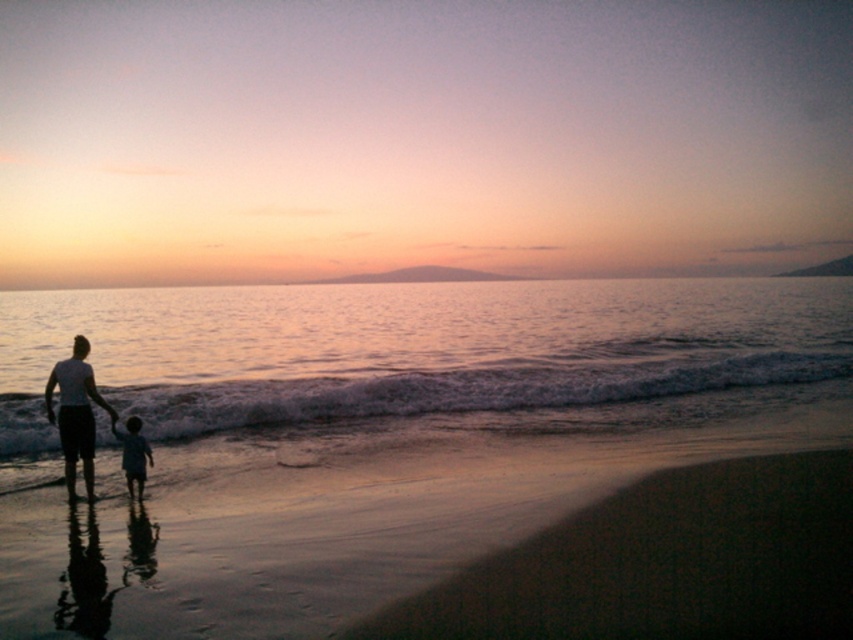
You are standing on the sandy beach at lower left and want to reach the shiny silver water at center. Which direction should you move to get there?

The shiny silver water at center is above the sandy beach at lower left, so you should move upward to reach it.